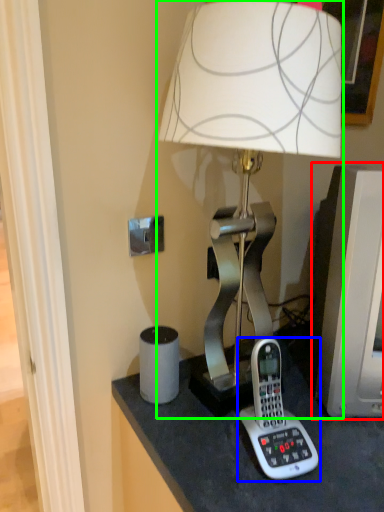
Question: Which object is the closest to the computer monitor (highlighted by a red box)? Choose among these: corded phone (highlighted by a blue box) or lamp (highlighted by a green box).

Choices:
 (A) corded phone
 (B) lamp

Answer: (A)